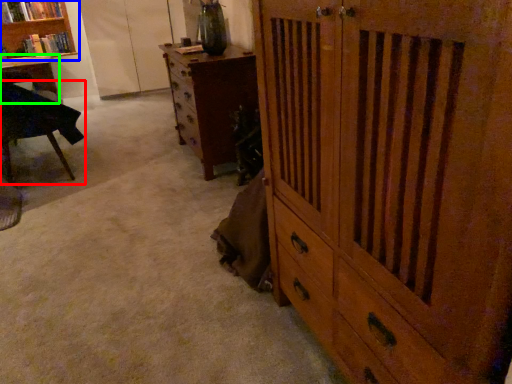
Question: Based on their relative distances, which object is nearer to chair (highlighted by a red box)? Choose from bookcase (highlighted by a blue box) and desk (highlighted by a green box).

Choices:
 (A) bookcase
 (B) desk

Answer: (B)